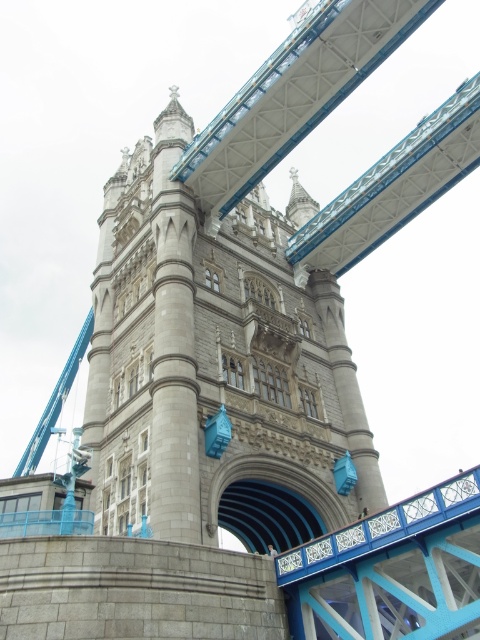
In the scene shown: What are the coordinates of the stone tower at center in the image?

The coordinates of the stone tower at center are at point (216, 365).

You are a tourist standing on the walkway of the smooth blue bridge at center. You want to take a photo of the stone tower at center. Which direction should you face to capture it in your shot?

The smooth blue bridge at center is behind the stone tower at center, so you should face towards the stone tower at center to capture it in your shot.

You are a delivery drone with a wingspan of 6 feet. You need to fly through the gap between the stone tower at center and the smooth blue bridge at center. Can you safely pass through this gap without touching either structure?

The gap between the stone tower at center and the smooth blue bridge at center is 79.86 feet. Since your drone has a wingspan of only 6 feet, there is ample space for you to safely navigate through the gap without any risk of collision.